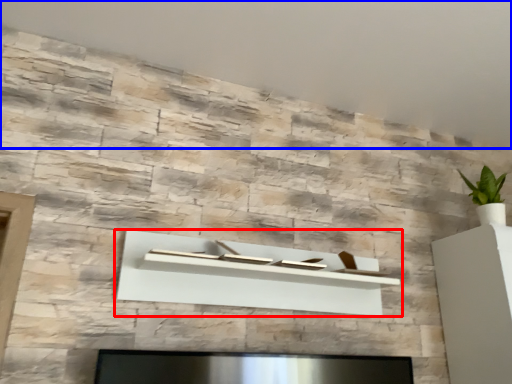
Question: Which object appears closest to the camera in this image, shelf (highlighted by a red box) or backdrop (highlighted by a blue box)?

Choices:
 (A) shelf
 (B) backdrop

Answer: (B)